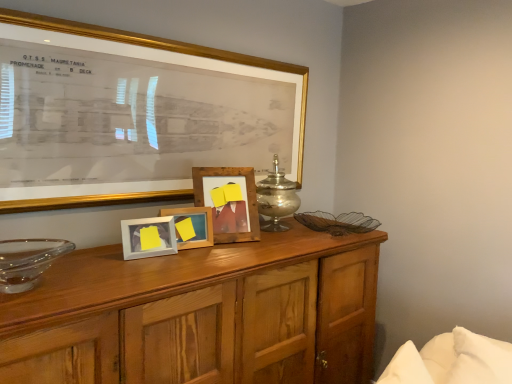
Where is `vacant space that's between white matte picture frame at center, marked as the third picture frame in a back-to-front arrangement, and transparent glass bowl at left`? This screenshot has width=512, height=384. vacant space that's between white matte picture frame at center, marked as the third picture frame in a back-to-front arrangement, and transparent glass bowl at left is located at coordinates (103, 262).